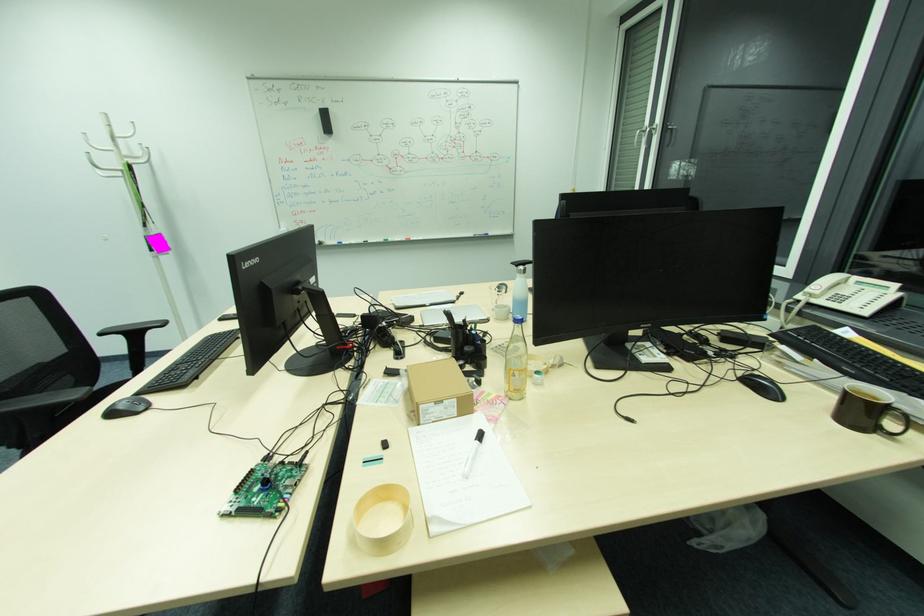
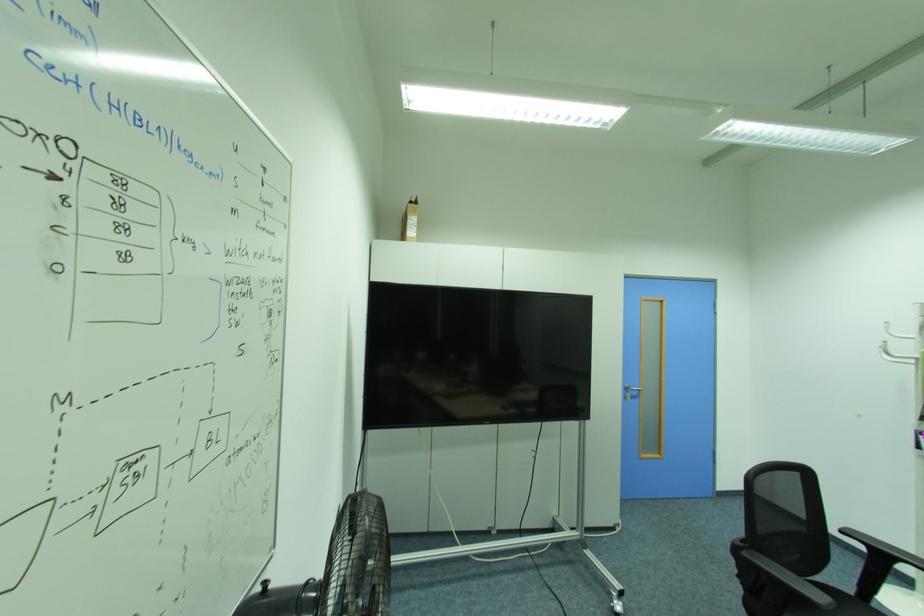
Find the pixel in the second image that matches [123,174] in the first image.

(917, 361)